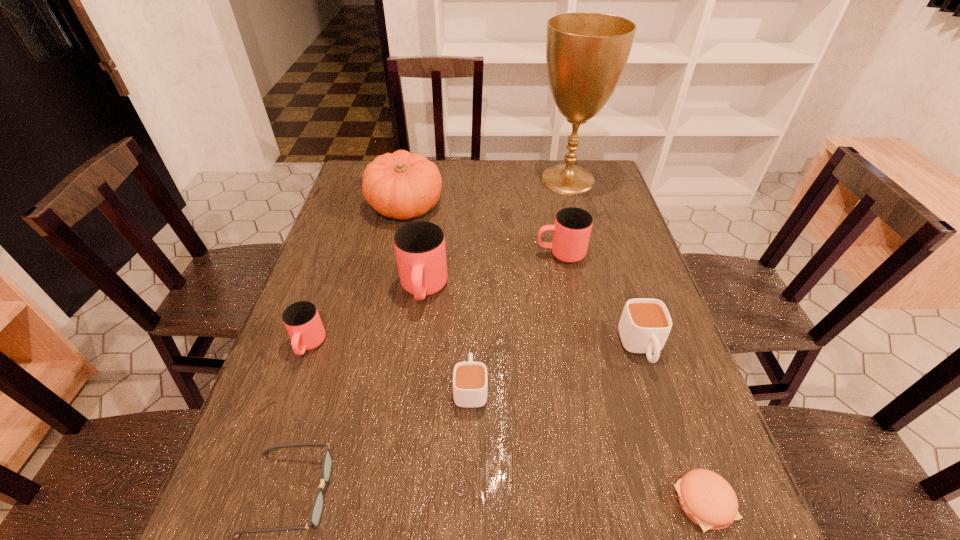
Find the location of a particular element. The width and height of the screenshot is (960, 540). empty location between the second smallest pink cup and the fifth object from left to right is located at coordinates (516, 320).

Where is `vacant space that's between the nearest pink cup and the fifth object from right to left`? The image size is (960, 540). vacant space that's between the nearest pink cup and the fifth object from right to left is located at coordinates (390, 366).

Identify the location of free spot between the trophy cup and the smaller white cup. This screenshot has width=960, height=540. (519, 283).

You are a GUI agent. You are given a task and a screenshot of the screen. Output one action in this format:
    pyautogui.click(x=<x>, y=<y>)
    Task: Click on the free point between the second pink cup from left to right and the left white cup
    
    Given the screenshot: What is the action you would take?
    pyautogui.click(x=447, y=339)

Point out which object is positioned as the second nearest to the gray spectacles. Please provide its 2D coordinates. Your answer should be formatted as a tuple, i.e. [(x, y)], where the tuple contains the x and y coordinates of a point satisfying the conditions above.

[(470, 384)]

Select which object is the eighth closest to the orange pumpkin. Please provide its 2D coordinates. Your answer should be formatted as a tuple, i.e. [(x, y)], where the tuple contains the x and y coordinates of a point satisfying the conditions above.

[(706, 498)]

Where is `cup that stands as the closest to the right white cup`? cup that stands as the closest to the right white cup is located at coordinates (571, 231).

Identify which cup is the third closest to the patty. Please provide its 2D coordinates. Your answer should be formatted as a tuple, i.e. [(x, y)], where the tuple contains the x and y coordinates of a point satisfying the conditions above.

[(571, 231)]

Where is `the second closest pink cup to the third cup from right to left`? the second closest pink cup to the third cup from right to left is located at coordinates coord(301,319).

The height and width of the screenshot is (540, 960). Identify the location of pink cup identified as the third closest to the left white cup. [571, 231].